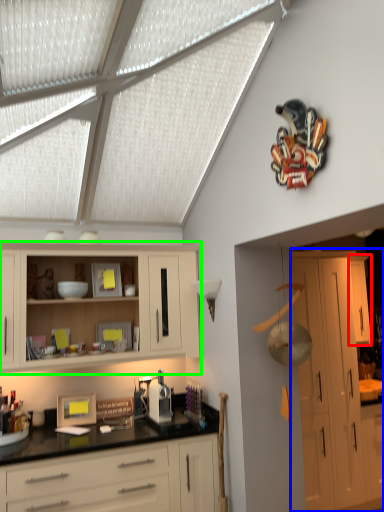
Question: Which is farther away from cabinetry (highlighted by a red box)? cabinetry (highlighted by a blue box) or cabinetry (highlighted by a green box)?

Choices:
 (A) cabinetry
 (B) cabinetry

Answer: (B)